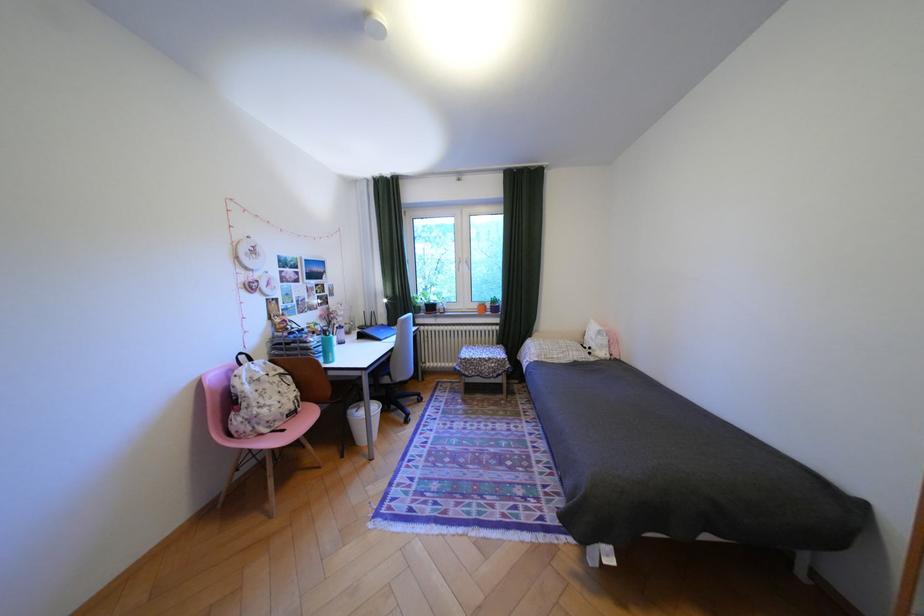
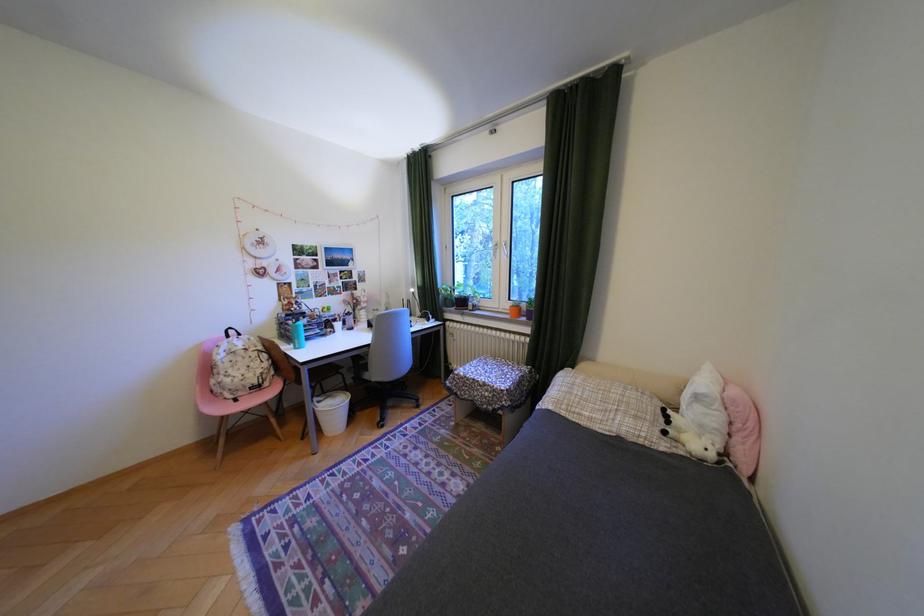
In the second image, find the point that corresponds to point (602, 353) in the first image.

(676, 432)